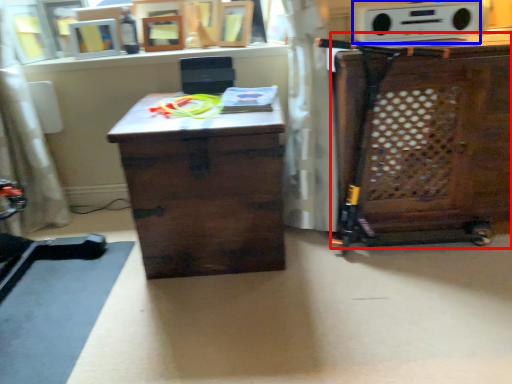
Question: Among these objects, which one is farthest to the camera, cabinetry (highlighted by a red box) or stereo (highlighted by a blue box)?

Choices:
 (A) cabinetry
 (B) stereo

Answer: (B)